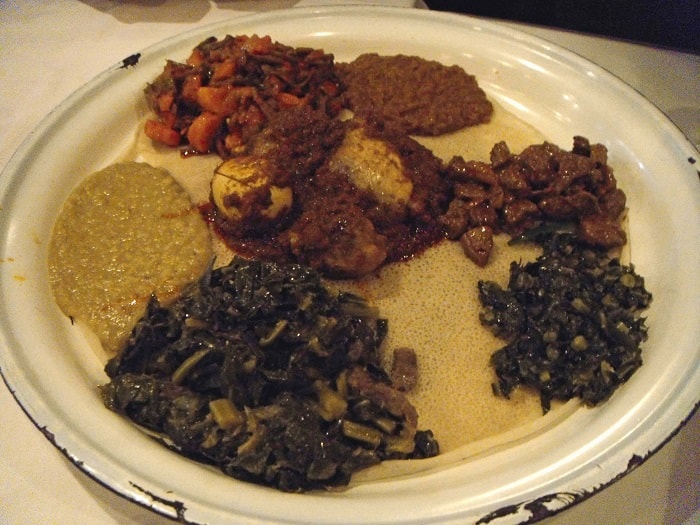
The image size is (700, 525). I want to click on peeling paint, so click(176, 508), click(540, 508), click(509, 505), click(640, 458), click(50, 436), click(130, 57).